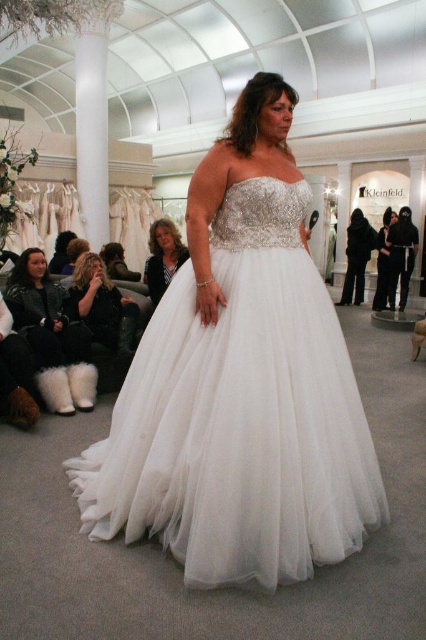
Does white tulle dress at center have a lesser height compared to black satin dress at center?

No.

Which of these two, white tulle dress at center or black satin dress at center, stands taller?

white tulle dress at center

The height and width of the screenshot is (640, 426). Describe the element at coordinates (239, 385) in the screenshot. I see `white tulle dress at center` at that location.

Image resolution: width=426 pixels, height=640 pixels. I want to click on white tulle dress at center, so click(x=239, y=385).

Does white faux fur boots at lower left have a greater height compared to fuzzy black boots at lower left?

Yes.

Between white faux fur boots at lower left and fuzzy black boots at lower left, which one is positioned higher?

fuzzy black boots at lower left is higher up.

Find the location of a particular element. This screenshot has height=640, width=426. white faux fur boots at lower left is located at coordinates (x=51, y=336).

I want to click on fuzzy black boots at lower left, so click(104, 317).

Is fuzzy black boots at lower left taller than matte black jacket at center?

Yes.

Who is more forward, (106, 353) or (161, 243)?

Point (106, 353) is more forward.

Where is `fuzzy black boots at lower left`? The image size is (426, 640). fuzzy black boots at lower left is located at coordinates (104, 317).